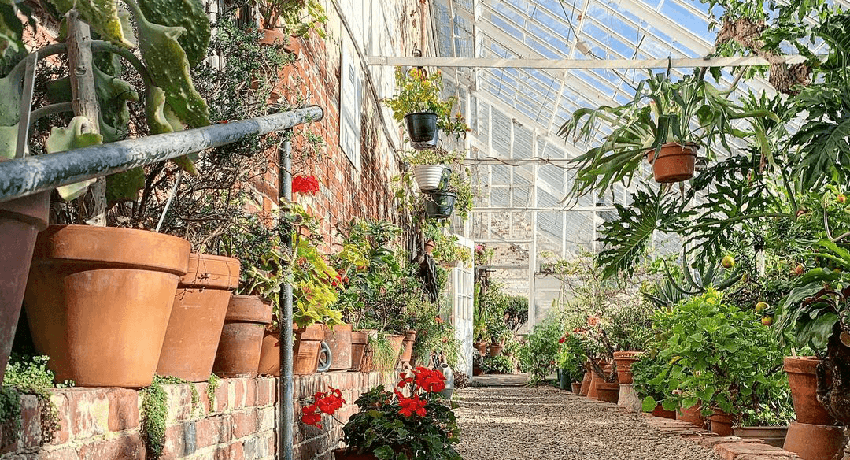
Where is `white door`? white door is located at coordinates (461, 301).